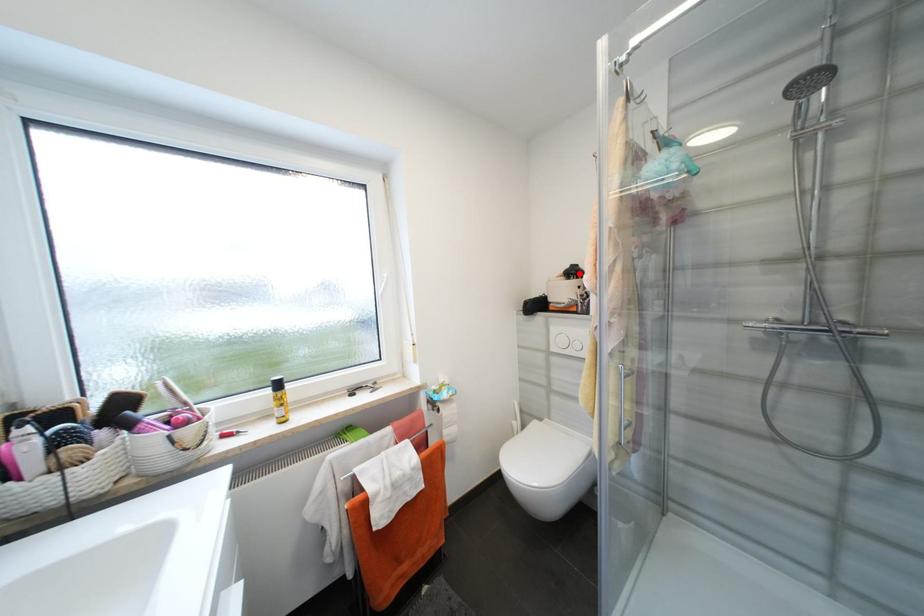
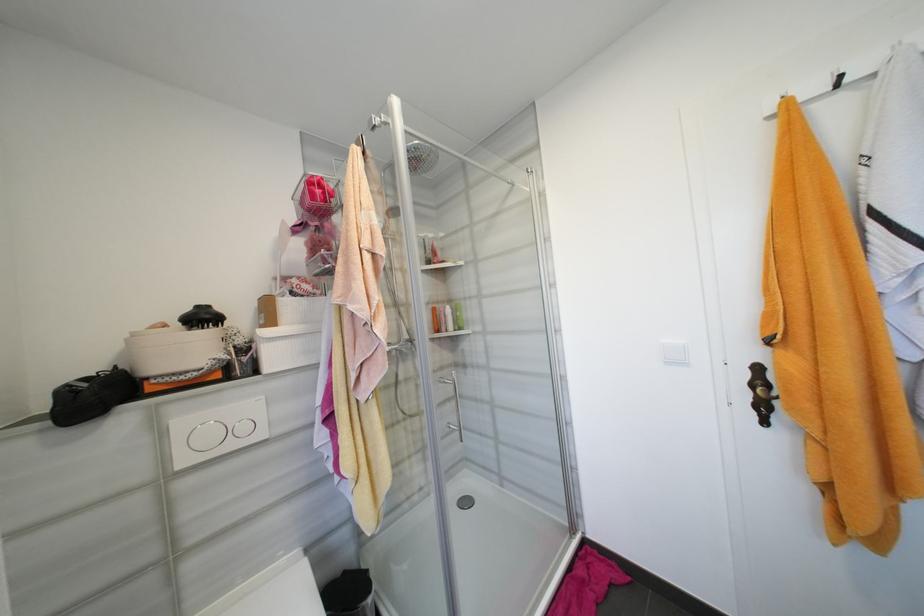
In the second image, find the point that corresponds to the highlighted location in the first image.

(210, 318)